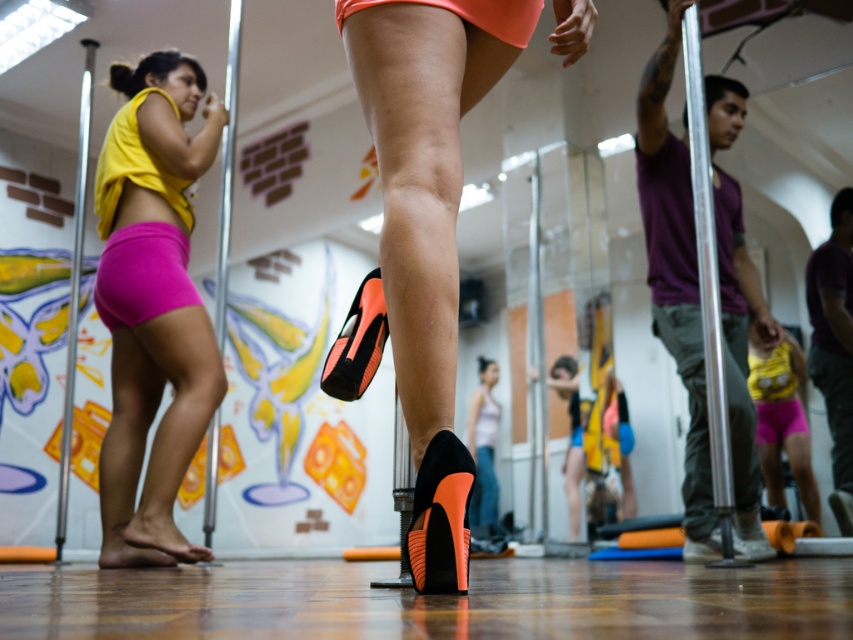
You are standing in the dance studio and want to reach a specific point marked at coordinates point (496, 19). If your maximum comfortable reach is 5 feet, can you comfortably reach that point without moving closer?

The distance of point (496, 19) from camera is 5.06 feet. Since your maximum comfortable reach is 5 feet, you cannot comfortably reach that point without moving closer.